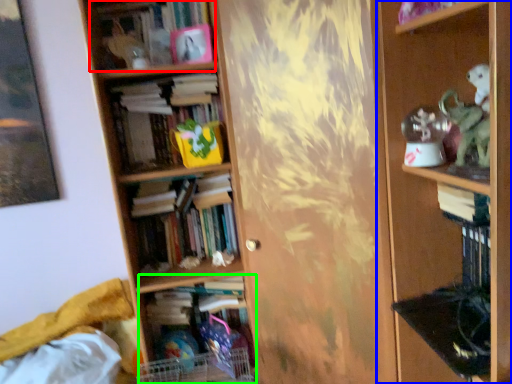
Question: Considering the real-world distances, which object is farthest from book (highlighted by a red box)? shelf (highlighted by a blue box) or book (highlighted by a green box)?

Choices:
 (A) shelf
 (B) book

Answer: (B)